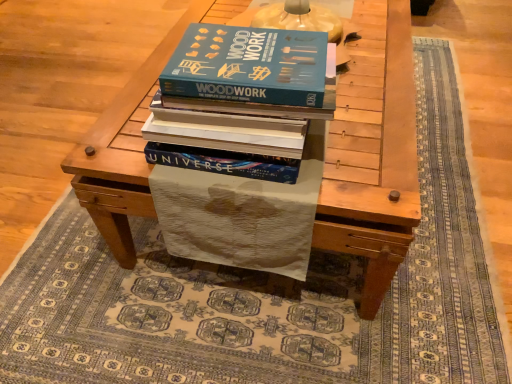
What do you see at coordinates (239, 100) in the screenshot? The height and width of the screenshot is (384, 512). I see `blue hardcover book at center` at bounding box center [239, 100].

This screenshot has width=512, height=384. Identify the location of blue hardcover book at center. (239, 100).

Where is `wooden table at center`? Image resolution: width=512 pixels, height=384 pixels. wooden table at center is located at coordinates (379, 170).

What is the approximate width of wooden table at center?

The width of wooden table at center is 28.84 inches.

The width and height of the screenshot is (512, 384). Describe the element at coordinates (379, 170) in the screenshot. I see `wooden table at center` at that location.

I want to click on blue hardcover book at center, so click(239, 100).

In the scene shown: Is blue hardcover book at center to the left or to the right of wooden table at center in the image?

blue hardcover book at center is positioned on wooden table at center's left side.

Which object is closer to the camera, blue hardcover book at center or wooden table at center?

Positioned in front is blue hardcover book at center.

Which is less distant, (196,142) or (96,207)?

Point (196,142) is closer to the camera than point (96,207).

Looking at this image, from the image's perspective, is blue hardcover book at center located above or below wooden table at center?

Clearly, from the image's perspective, blue hardcover book at center is below wooden table at center.

From a real-world perspective, which is physically below, blue hardcover book at center or wooden table at center?

From a 3D spatial view, wooden table at center is below.

Between blue hardcover book at center and wooden table at center, which one has larger width?

wooden table at center is wider.

Who is shorter, blue hardcover book at center or wooden table at center?

Standing shorter between the two is blue hardcover book at center.

Between blue hardcover book at center and wooden table at center, which one has larger size?

wooden table at center.

Choose the correct answer: Is blue hardcover book at center inside wooden table at center or outside it?

blue hardcover book at center lies outside wooden table at center.

Is blue hardcover book at center directly adjacent to wooden table at center?

No, blue hardcover book at center is not touching wooden table at center.

Is blue hardcover book at center facing away from wooden table at center?

No, blue hardcover book at center's orientation is not away from wooden table at center.

What are the coordinates of `table located behind the blue hardcover book at center` in the screenshot? It's located at (379, 170).

Is wooden table at center at the right side of blue hardcover book at center?

Correct, you'll find wooden table at center to the right of blue hardcover book at center.

Is wooden table at center in front of blue hardcover book at center?

No, it is behind blue hardcover book at center.

Between point (159, 46) and point (248, 138), which one is positioned in front?

Point (248, 138)

From the image's perspective, is wooden table at center located above blue hardcover book at center?

Yes.

From a real-world perspective, is wooden table at center physically located above or below blue hardcover book at center?

In terms of real-world spatial position, wooden table at center is below blue hardcover book at center.

Between wooden table at center and blue hardcover book at center, which one has smaller width?

With smaller width is blue hardcover book at center.

Considering the sizes of wooden table at center and blue hardcover book at center in the image, is wooden table at center taller or shorter than blue hardcover book at center?

In the image, wooden table at center appears to be taller than blue hardcover book at center.

Does wooden table at center have a smaller size compared to blue hardcover book at center?

No.

Is wooden table at center spatially inside blue hardcover book at center, or outside of it?

The correct answer is: outside.

Are wooden table at center and blue hardcover book at center located far from each other?

No, there isn't a large distance between wooden table at center and blue hardcover book at center.

Is wooden table at center aimed at blue hardcover book at center?

No, wooden table at center is not facing towards blue hardcover book at center.

Can you tell me how much wooden table at center and blue hardcover book at center differ in facing direction?

The facing directions of wooden table at center and blue hardcover book at center are 180 degrees apart.

Measure the distance from wooden table at center to blue hardcover book at center.

wooden table at center and blue hardcover book at center are 9.42 inches apart from each other.

Locate an element on the screen. book located in front of the wooden table at center is located at coordinates (239, 100).

Image resolution: width=512 pixels, height=384 pixels. In order to click on book above the wooden table at center (from a real-world perspective) in this screenshot , I will do `click(239, 100)`.

What are the coordinates of `table behind the blue hardcover book at center` in the screenshot? It's located at (379, 170).